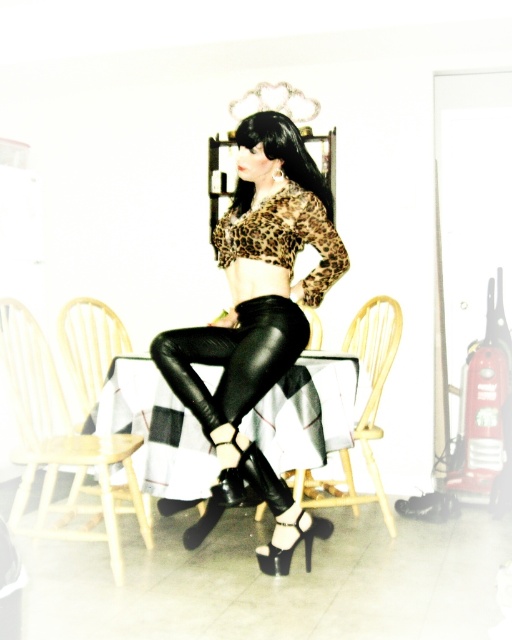
Question: From the image, what is the correct spatial relationship of leopard print fabric at center in relation to light wood chair at left?

Choices:
 (A) below
 (B) above

Answer: (B)

Question: Does leopard print fabric at center appear over wooden chair at center?

Choices:
 (A) yes
 (B) no

Answer: (A)

Question: Which point is farther to the camera?

Choices:
 (A) (369, 440)
 (B) (52, 406)
 (C) (224, 339)

Answer: (B)

Question: Which point appears farthest from the camera in this image?

Choices:
 (A) (68, 301)
 (B) (73, 506)
 (C) (309, 563)
 (D) (197, 337)

Answer: (A)

Question: Is leopard print fabric at center thinner than light wood chair at left?

Choices:
 (A) no
 (B) yes

Answer: (B)

Question: Which point appears closest to the camera in this image?

Choices:
 (A) (286, 218)
 (B) (94, 352)
 (C) (16, 314)

Answer: (A)